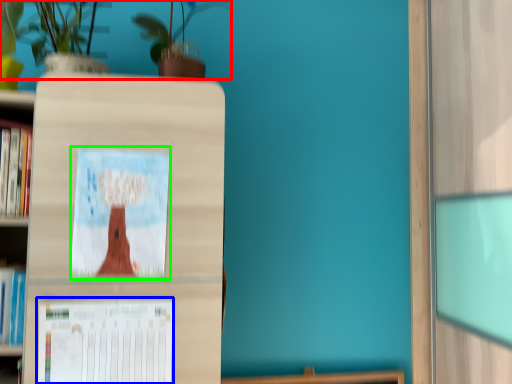
Question: Considering the real-world distances, which object is farthest from floral arrangement (highlighted by a red box)? paperback book (highlighted by a blue box) or picture frame (highlighted by a green box)?

Choices:
 (A) paperback book
 (B) picture frame

Answer: (A)